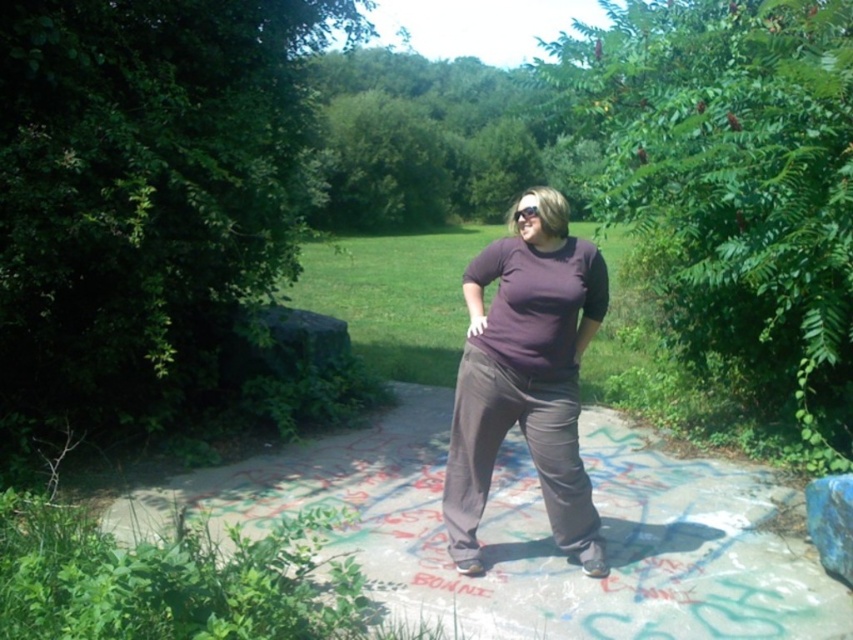
Question: Does concrete sidewalk at center have a greater width compared to purple matte shirt at center?

Choices:
 (A) yes
 (B) no

Answer: (A)

Question: Among these points, which one is nearest to the camera?

Choices:
 (A) (537, 276)
 (B) (415, 424)

Answer: (A)

Question: Is concrete sidewalk at center positioned before purple matte shirt at center?

Choices:
 (A) no
 (B) yes

Answer: (B)

Question: Which point is farther to the camera?

Choices:
 (A) (480, 433)
 (B) (672, 516)

Answer: (B)

Question: Can you confirm if concrete sidewalk at center is positioned above purple matte shirt at center?

Choices:
 (A) yes
 (B) no

Answer: (B)

Question: Which point is closer to the camera taking this photo?

Choices:
 (A) pyautogui.click(x=598, y=272)
 (B) pyautogui.click(x=553, y=625)

Answer: (B)